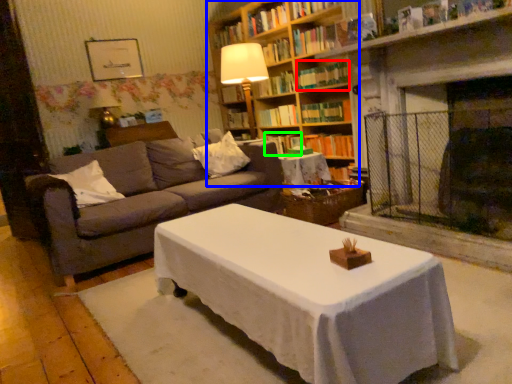
Question: Considering the real-world distances, which object is farthest from book (highlighted by a red box)? bookcase (highlighted by a blue box) or book (highlighted by a green box)?

Choices:
 (A) bookcase
 (B) book

Answer: (B)